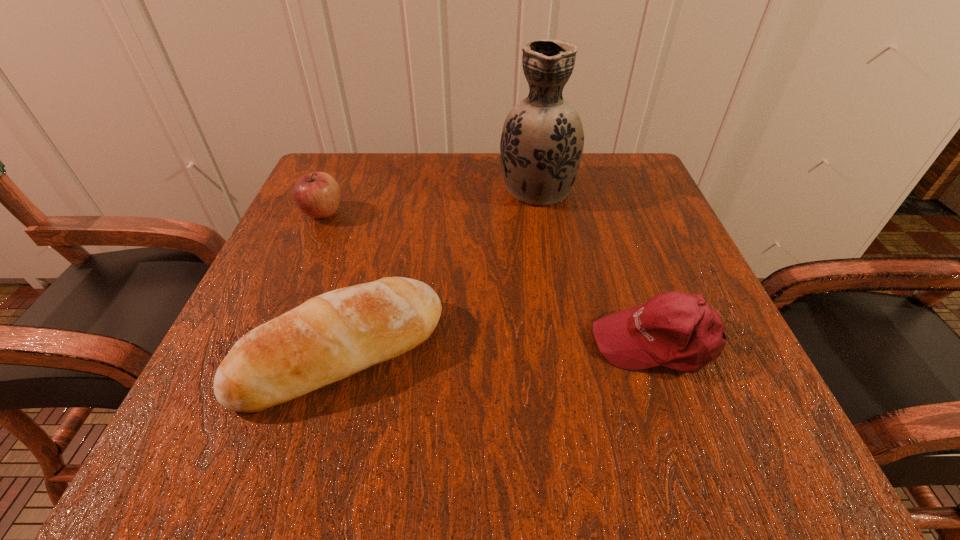
Locate an element on the screen. Image resolution: width=960 pixels, height=540 pixels. apple that is positioned at the far edge is located at coordinates (318, 195).

Find the location of a particular element. This screenshot has width=960, height=540. object that is at the near edge is located at coordinates [332, 336].

Image resolution: width=960 pixels, height=540 pixels. I want to click on apple located at the left edge, so click(x=318, y=195).

Find the location of a particular element. Image resolution: width=960 pixels, height=540 pixels. bread present at the left edge is located at coordinates (332, 336).

In order to click on object that is positioned at the right edge in this screenshot , I will do tap(679, 331).

At what (x,y) coordinates should I click in order to perform the action: click on object at the far left corner. Please return your answer as a coordinate pair (x, y). The width and height of the screenshot is (960, 540). Looking at the image, I should click on (318, 195).

You are a GUI agent. You are given a task and a screenshot of the screen. Output one action in this format:
    pyautogui.click(x=<x>, y=<y>)
    Task: Click on the object positioned at the near left corner
    This screenshot has width=960, height=540.
    Given the screenshot: What is the action you would take?
    pyautogui.click(x=332, y=336)

You are a GUI agent. You are given a task and a screenshot of the screen. Output one action in this format:
    pyautogui.click(x=<x>, y=<y>)
    Task: Click on the free point at the far edge
    This screenshot has height=540, width=960.
    Given the screenshot: What is the action you would take?
    pyautogui.click(x=484, y=207)

At what (x,y) coordinates should I click in order to perform the action: click on blank area at the near edge. Please return your answer as a coordinate pair (x, y). The height and width of the screenshot is (540, 960). Looking at the image, I should click on pos(396,434).

Locate an element on the screen. This screenshot has height=540, width=960. vacant region at the left edge of the desktop is located at coordinates (365, 228).